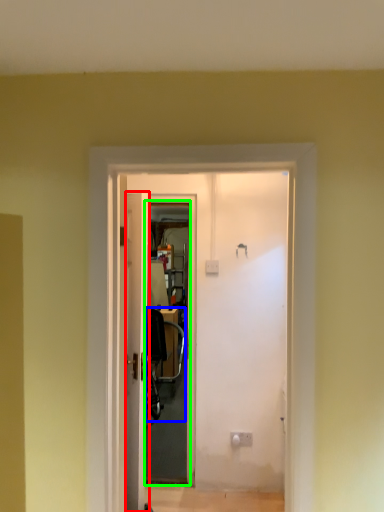
Question: Based on their relative distances, which object is farther from door (highlighted by a red box)? Choose from chair (highlighted by a blue box) and screen door (highlighted by a green box).

Choices:
 (A) chair
 (B) screen door

Answer: (A)